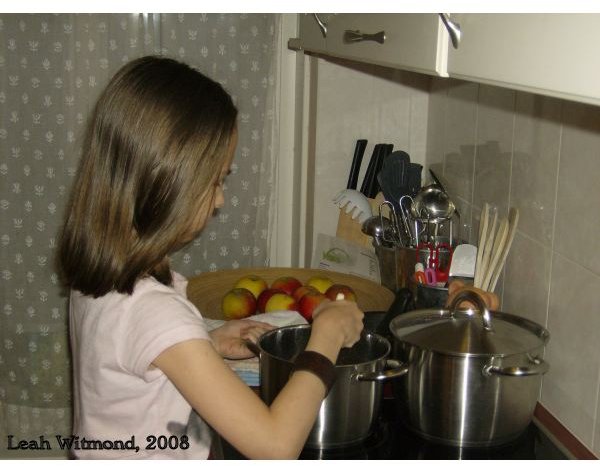
The height and width of the screenshot is (466, 600). Identify the location of kitchen utensils. (385, 171), (415, 207), (471, 237).